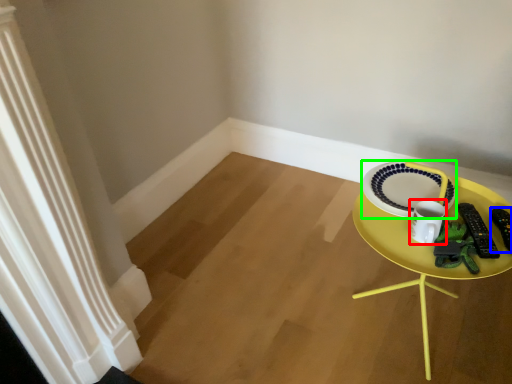
Question: Considering the real-world distances, which object is farthest from coffee cup (highlighted by a red box)? remote control (highlighted by a blue box) or plate (highlighted by a green box)?

Choices:
 (A) remote control
 (B) plate

Answer: (A)